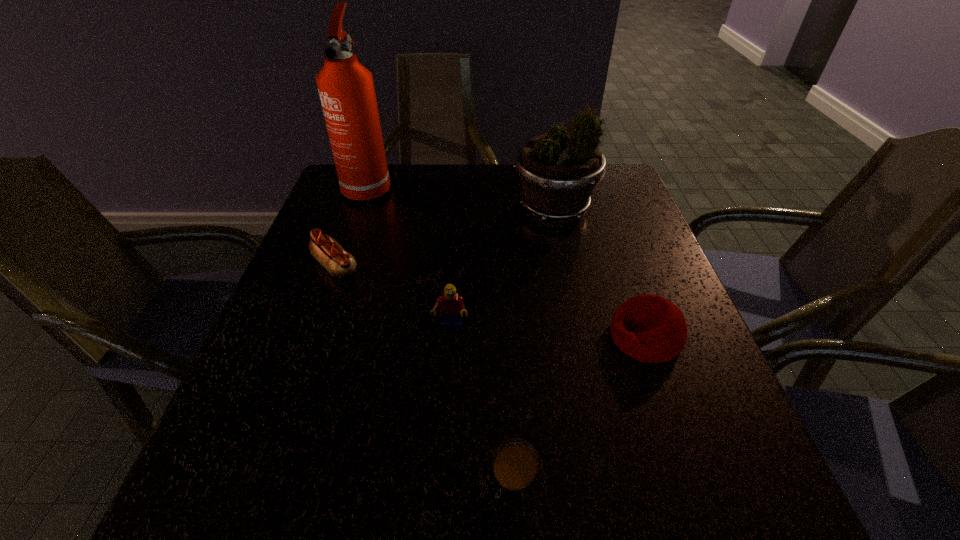
This screenshot has height=540, width=960. In order to click on fire extinguisher in this screenshot , I will do `click(346, 89)`.

Image resolution: width=960 pixels, height=540 pixels. In order to click on flowerpot in this screenshot , I will do `click(558, 172)`.

Find the location of a particular element. the fourth shortest object is located at coordinates (452, 306).

Locate an element on the screen. the fourth object from right to left is located at coordinates (452, 306).

Identify the location of beanbag. The height and width of the screenshot is (540, 960). (650, 328).

Find the location of a particular element. The width and height of the screenshot is (960, 540). sausage is located at coordinates tap(339, 263).

Find the location of a particular element. cappuccino is located at coordinates (514, 479).

This screenshot has width=960, height=540. Find the location of `free space located at the nozzle of the fire extinguisher`. free space located at the nozzle of the fire extinguisher is located at coordinates (338, 273).

Locate an element on the screen. This screenshot has width=960, height=540. vacant space located on the front of the flowerpot is located at coordinates (569, 284).

The image size is (960, 540). Find the location of `vacant area situated 0.310m on the front-facing side of the Lego`. vacant area situated 0.310m on the front-facing side of the Lego is located at coordinates (439, 497).